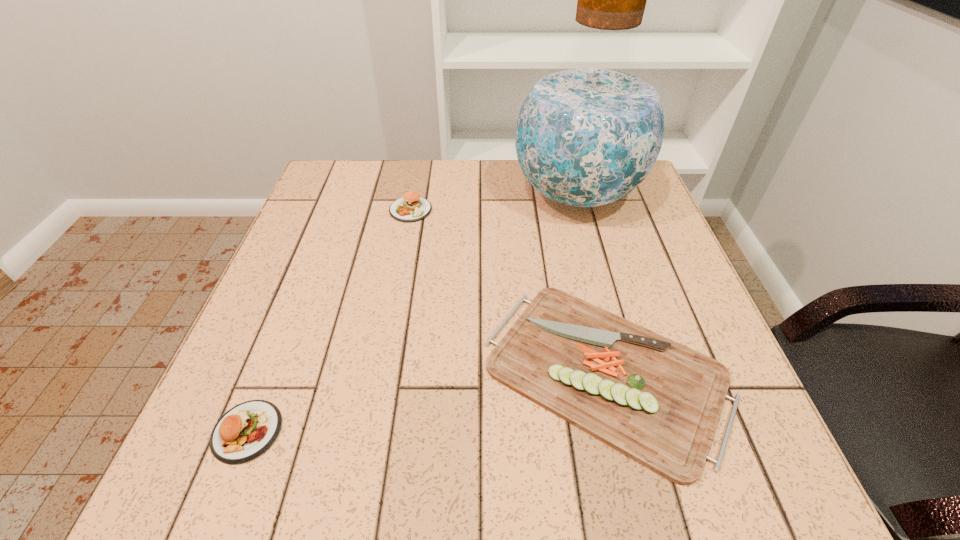
Where is `water jug`? The width and height of the screenshot is (960, 540). water jug is located at coordinates (590, 130).

Identify the location of the right patty (food). (411, 207).

Image resolution: width=960 pixels, height=540 pixels. I want to click on the farther patty (food), so click(x=411, y=207).

This screenshot has height=540, width=960. I want to click on the leftmost object, so click(x=247, y=430).

Find the location of `the left patty (food)`. the left patty (food) is located at coordinates (247, 430).

Locate an element on the screen. The height and width of the screenshot is (540, 960). chopping board is located at coordinates pos(658,402).

This screenshot has height=540, width=960. Identify the location of blank space located on the left of the water jug. (423, 194).

You are a GUI agent. You are given a task and a screenshot of the screen. Output one action in this format:
    pyautogui.click(x=<x>, y=<y>)
    Task: Click on the free point located on the back of the right patty (food)
    The height and width of the screenshot is (540, 960).
    Given the screenshot: What is the action you would take?
    pyautogui.click(x=417, y=179)

You are a GUI agent. You are given a task and a screenshot of the screen. Output one action in this format:
    pyautogui.click(x=<x>, y=<y>)
    Task: Click on the free space located on the back of the leftmost object
    
    Given the screenshot: What is the action you would take?
    pyautogui.click(x=276, y=356)

Where is `vacant region located 0.060m on the back of the shortest object`? vacant region located 0.060m on the back of the shortest object is located at coordinates (582, 271).